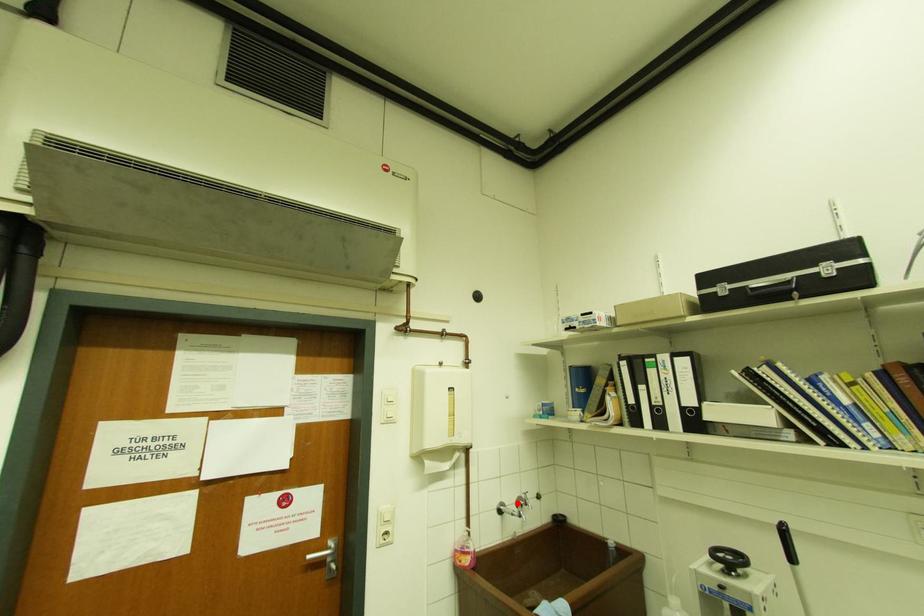
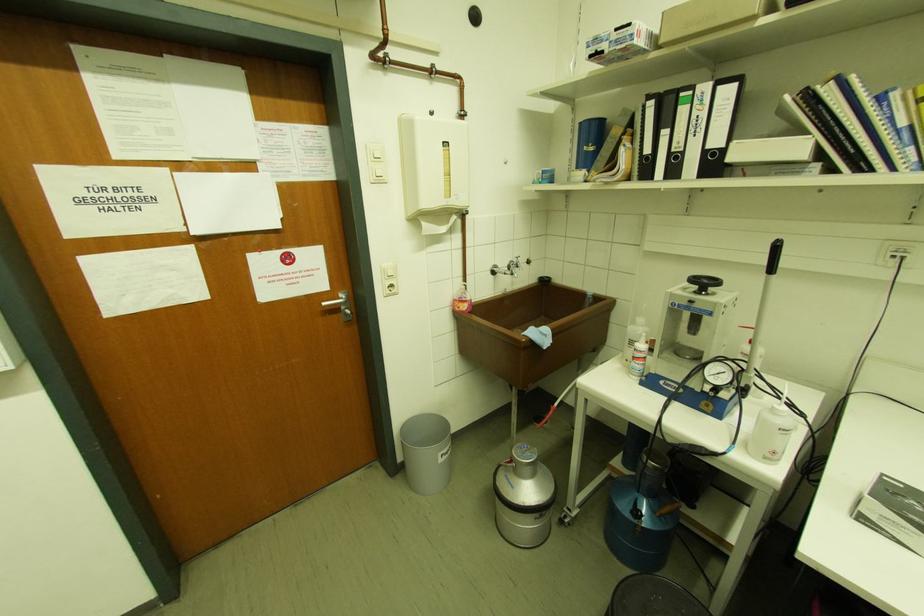
Question: I am providing you with two images of the same scene from different viewpoints. Image1 has a red point marked. In image2, the corresponding 3D location appears at what relative position? Reply with the corresponding letter.

Choices:
 (A) Closer
 (B) Farther

Answer: (A)